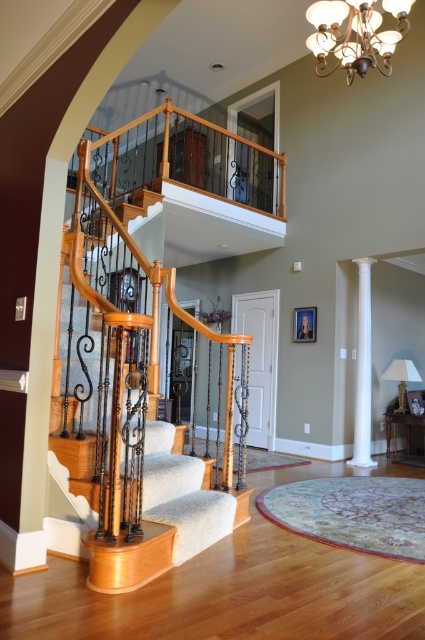
Is wooden staircase with carpeted steps at left below matte gold chandelier at upper center?

Answer: Yes, wooden staircase with carpeted steps at left is below matte gold chandelier at upper center.

Does point (153, 326) come in front of point (407, 3)?

No, it is not.

Does point (201, 528) come in front of point (385, 58)?

Yes, point (201, 528) is in front of point (385, 58).

I want to click on wooden staircase with carpeted steps at left, so click(141, 422).

Is point (374, 0) in front of point (368, 374)?

Yes, it is.

Which of these two, matte gold chandelier at upper center or white smooth column at right, stands taller?

With more height is white smooth column at right.

Describe the element at coordinates (356, 33) in the screenshot. I see `matte gold chandelier at upper center` at that location.

Locate an element on the screen. The image size is (425, 640). matte gold chandelier at upper center is located at coordinates (356, 33).

Which is below, wooden staircase with carpeted steps at left or white smooth column at right?

white smooth column at right is below.

Who is more distant from viewer, (153, 451) or (370, 397)?

The point (370, 397) is behind.

I want to click on wooden staircase with carpeted steps at left, so click(141, 422).